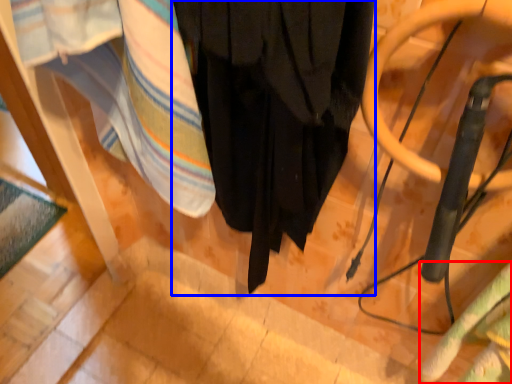
Question: Which of the following is the closest to the observer, blanket (highlighted by a red box) or curtain (highlighted by a blue box)?

Choices:
 (A) blanket
 (B) curtain

Answer: (B)